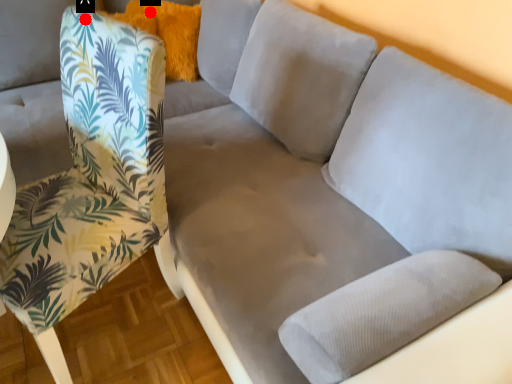
Question: Two points are circled on the image, labeled by A and B beside each circle. Among these points, which one is farthest from the camera?

Choices:
 (A) A is further
 (B) B is further

Answer: (B)